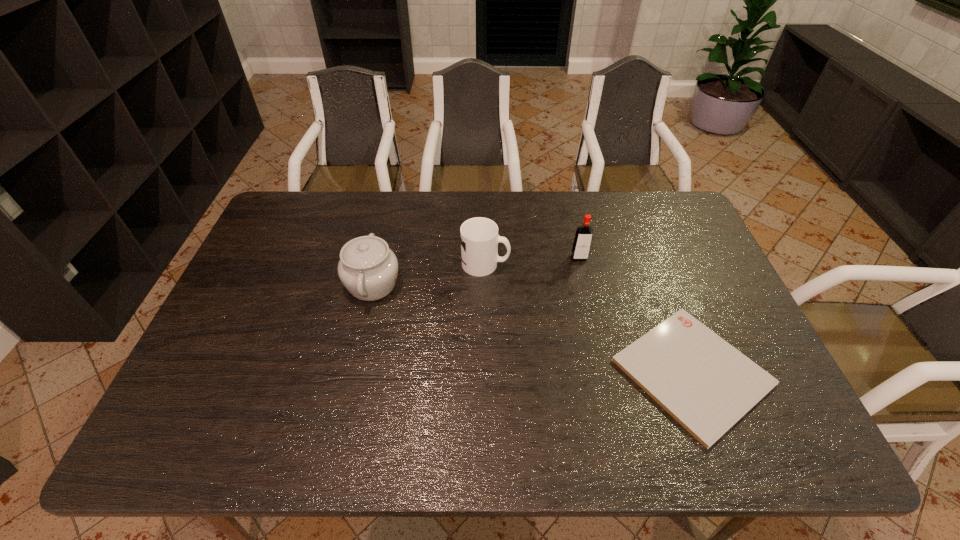
The height and width of the screenshot is (540, 960). Find the location of `vodka`. vodka is located at coordinates (581, 246).

Where is `chinaware`? The image size is (960, 540). chinaware is located at coordinates (368, 268).

Identify the location of the third object from right to left. (479, 236).

I want to click on the shortest object, so click(704, 383).

Where is `free space located 0.360m on the front and back of the vodka`? The image size is (960, 540). free space located 0.360m on the front and back of the vodka is located at coordinates (602, 360).

This screenshot has height=540, width=960. Identify the location of free space located 0.070m on the left of the leftmost object. (320, 285).

This screenshot has width=960, height=540. What are the coordinates of `vacant region located on the handle side of the third object from right to left` in the screenshot? It's located at (613, 264).

Locate an element on the screen. vacant space located on the back of the shortest object is located at coordinates (636, 226).

In order to click on object located at the near edge in this screenshot , I will do `click(704, 383)`.

Where is `object that is at the right edge`? object that is at the right edge is located at coordinates (704, 383).